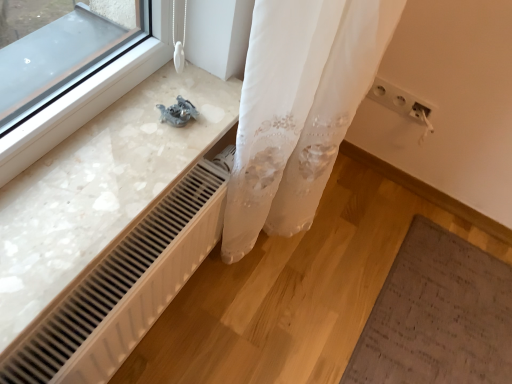
Where is `white plastic radiator at lower center`? The height and width of the screenshot is (384, 512). white plastic radiator at lower center is located at coordinates (125, 286).

Describe the element at coordinates (125, 286) in the screenshot. I see `white plastic radiator at lower center` at that location.

Find the location of a particular element. The width and height of the screenshot is (512, 384). white plastic electric outlet at upper right is located at coordinates (401, 102).

Describe the element at coordinates (401, 102) in the screenshot. I see `white plastic electric outlet at upper right` at that location.

In order to face white plastic electric outlet at upper right, should I rotate leftwards or rightwards?

You should rotate right by 18.524 degrees.

The image size is (512, 384). I want to click on white plastic radiator at lower center, so click(x=125, y=286).

Which object is positioned more to the left, white plastic electric outlet at upper right or white plastic radiator at lower center?

white plastic radiator at lower center.

Considering the positions of objects white plastic electric outlet at upper right and white plastic radiator at lower center in the image provided, who is in front, white plastic electric outlet at upper right or white plastic radiator at lower center?

white plastic radiator at lower center is closer to the camera.

Is point (406, 99) positioned before point (123, 354)?

That is False.

From the image's perspective, is white plastic electric outlet at upper right above or below white plastic radiator at lower center?

white plastic electric outlet at upper right is situated higher than white plastic radiator at lower center in the image.

From a real-world perspective, does white plastic electric outlet at upper right sit lower than white plastic radiator at lower center?

→ Actually, white plastic electric outlet at upper right is physically above white plastic radiator at lower center in the real world.

Does white plastic electric outlet at upper right have a lesser width compared to white plastic radiator at lower center?

Yes, white plastic electric outlet at upper right is thinner than white plastic radiator at lower center.

Does white plastic electric outlet at upper right have a lesser height compared to white plastic radiator at lower center?

Yes.

Does white plastic electric outlet at upper right have a smaller size compared to white plastic radiator at lower center?

Correct, white plastic electric outlet at upper right occupies less space than white plastic radiator at lower center.

Choose the correct answer: Is white plastic electric outlet at upper right inside white plastic radiator at lower center or outside it?

The correct answer is: outside.

Are white plastic electric outlet at upper right and white plastic radiator at lower center making contact?

No, white plastic electric outlet at upper right is not beside white plastic radiator at lower center.

Is white plastic electric outlet at upper right facing away from white plastic radiator at lower center?

No, white plastic radiator at lower center is not at the back of white plastic electric outlet at upper right.

How many degrees apart are the facing directions of white plastic electric outlet at upper right and white plastic radiator at lower center?

They differ by 90.3 degrees in their facing directions.

Identify the location of radiator in front of the white plastic electric outlet at upper right. Image resolution: width=512 pixels, height=384 pixels. (125, 286).

Between white plastic radiator at lower center and white plastic electric outlet at upper right, which one appears on the right side from the viewer's perspective?

white plastic electric outlet at upper right is more to the right.

Is white plastic radiator at lower center in front of or behind white plastic electric outlet at upper right in the image?

white plastic radiator at lower center is in front of white plastic electric outlet at upper right.

Which is closer, (112, 251) or (405, 95)?

Clearly, point (112, 251) is closer to the camera than point (405, 95).

From the image's perspective, relative to white plastic electric outlet at upper right, is white plastic radiator at lower center above or below?

Clearly, from the image's perspective, white plastic radiator at lower center is below white plastic electric outlet at upper right.

From a real-world perspective, is white plastic radiator at lower center positioned above or below white plastic electric outlet at upper right?

Clearly, from a real-world perspective, white plastic radiator at lower center is below white plastic electric outlet at upper right.

Between white plastic radiator at lower center and white plastic electric outlet at upper right, which one has smaller width?

white plastic electric outlet at upper right is thinner.

Is white plastic radiator at lower center taller than white plastic electric outlet at upper right?

Correct, white plastic radiator at lower center is much taller as white plastic electric outlet at upper right.

Between white plastic radiator at lower center and white plastic electric outlet at upper right, which one has larger size?

white plastic radiator at lower center is bigger.

Is white plastic radiator at lower center inside or outside of white plastic electric outlet at upper right?

white plastic radiator at lower center is outside white plastic electric outlet at upper right.

Can you see white plastic radiator at lower center touching white plastic electric outlet at upper right?

No, white plastic radiator at lower center is not beside white plastic electric outlet at upper right.

Consider the image. Could you tell me if white plastic radiator at lower center is facing white plastic electric outlet at upper right?

No, white plastic radiator at lower center is not aimed at white plastic electric outlet at upper right.

You are a GUI agent. You are given a task and a screenshot of the screen. Output one action in this format:
    pyautogui.click(x=<x>, y=<y>)
    Task: Click on the electric outlet behind the white plastic radiator at lower center
    The image size is (512, 384).
    Given the screenshot: What is the action you would take?
    pyautogui.click(x=401, y=102)

The image size is (512, 384). Identify the location of radiator on the left of white plastic electric outlet at upper right. (125, 286).

Locate an element on the screen. electric outlet that is above the white plastic radiator at lower center (from the image's perspective) is located at coordinates (401, 102).